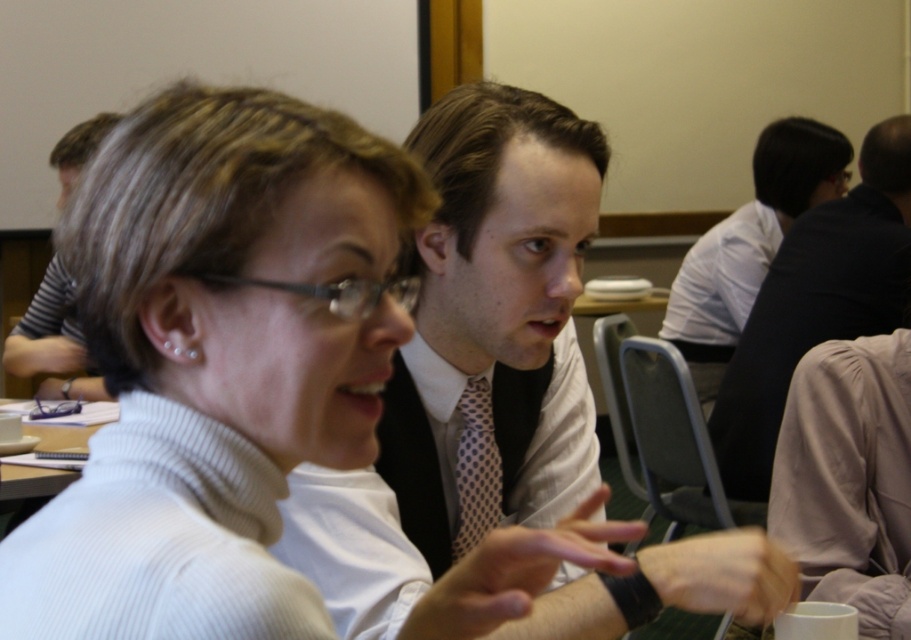
Question: Which point is farther to the camera?

Choices:
 (A) (48, 493)
 (B) (868, 260)
 (C) (488, 465)
 (D) (75, 342)

Answer: (D)

Question: Can you confirm if polka dot fabric tie at center is smaller than white paper at upper left?

Choices:
 (A) no
 (B) yes

Answer: (B)

Question: Among these points, which one is nearest to the camera?

Choices:
 (A) tap(9, 490)
 (B) tap(459, 397)

Answer: (B)

Question: Among these objects, which one is nearest to the camera?

Choices:
 (A) polka dot fabric tie at center
 (B) matte black shirt at upper left
 (C) white paper at upper left

Answer: (A)

Question: From the image, what is the correct spatial relationship of dark gray suit at upper right in relation to polka dot fabric tie at center?

Choices:
 (A) above
 (B) below

Answer: (A)

Question: Does polka dot fabric tie at center appear over white paper at upper left?

Choices:
 (A) no
 (B) yes

Answer: (B)